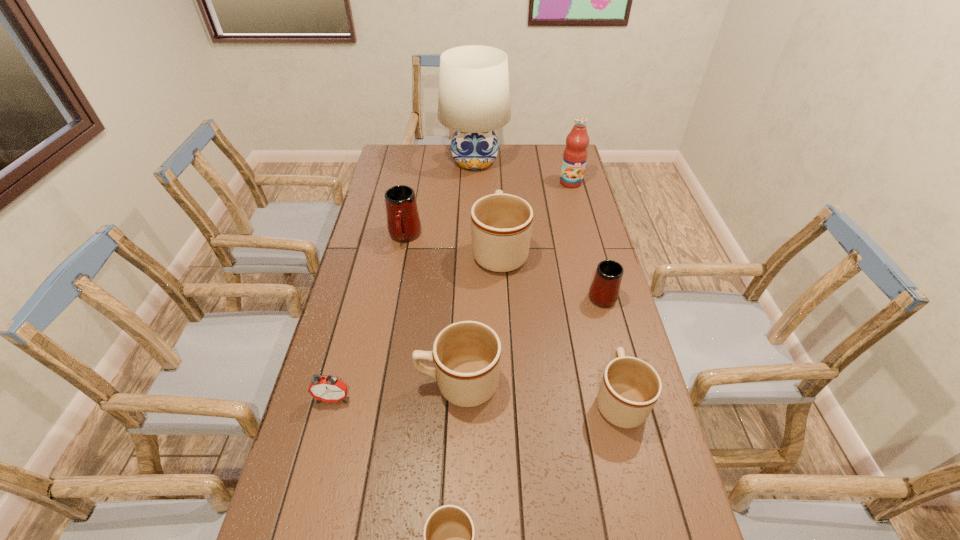
Image resolution: width=960 pixels, height=540 pixels. Identify the location of free spot between the third smallest brown mug and the fifth farthest object. (530, 339).

Find the location of a particular element. object that is the sixth closest to the fruit juice is located at coordinates (466, 354).

What are the coordinates of `object that can be found as the seventh closest to the eighth shortest object` in the screenshot? It's located at (327, 389).

Identify the location of mug that is the fifth closest to the fifth farthest object. This screenshot has width=960, height=540. (449, 534).

Identify the location of the fifth closest mug to the rightmost brown mug. (403, 222).

The image size is (960, 540). In order to click on the third closest brown mug to the tallest object in this screenshot , I will do `click(630, 387)`.

You are a GUI agent. You are given a task and a screenshot of the screen. Output one action in this format:
    pyautogui.click(x=<x>, y=<y>)
    Task: Click on the brown mug that is the third closest one to the biggest brown mug
    This screenshot has width=960, height=540.
    Given the screenshot: What is the action you would take?
    pyautogui.click(x=449, y=534)

Where is `vacant space that satisfies the following two spatial constraints: 1. on the side of the leftmost mug with the handle; 2. on the side of the third smallest brown mug with the handle`? vacant space that satisfies the following two spatial constraints: 1. on the side of the leftmost mug with the handle; 2. on the side of the third smallest brown mug with the handle is located at coordinates (377, 383).